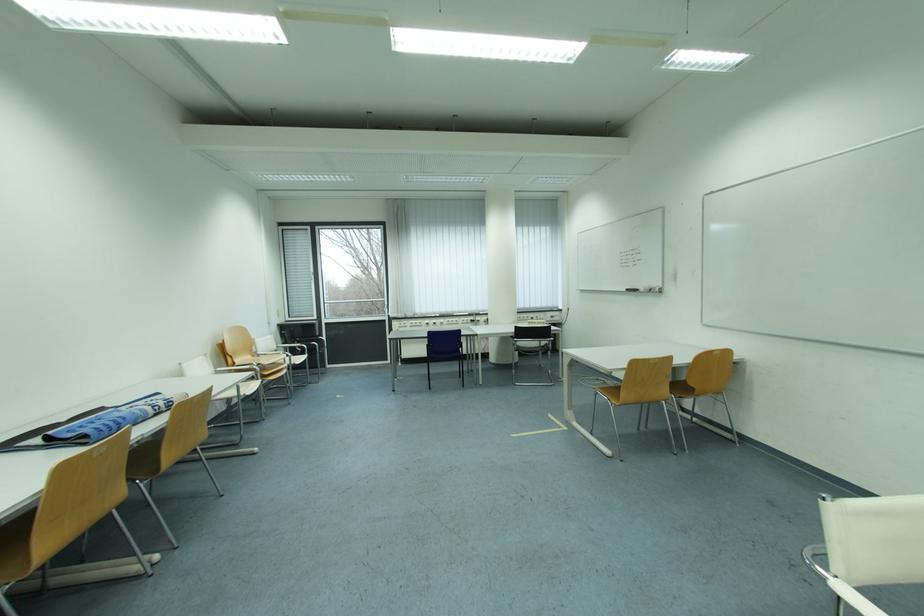
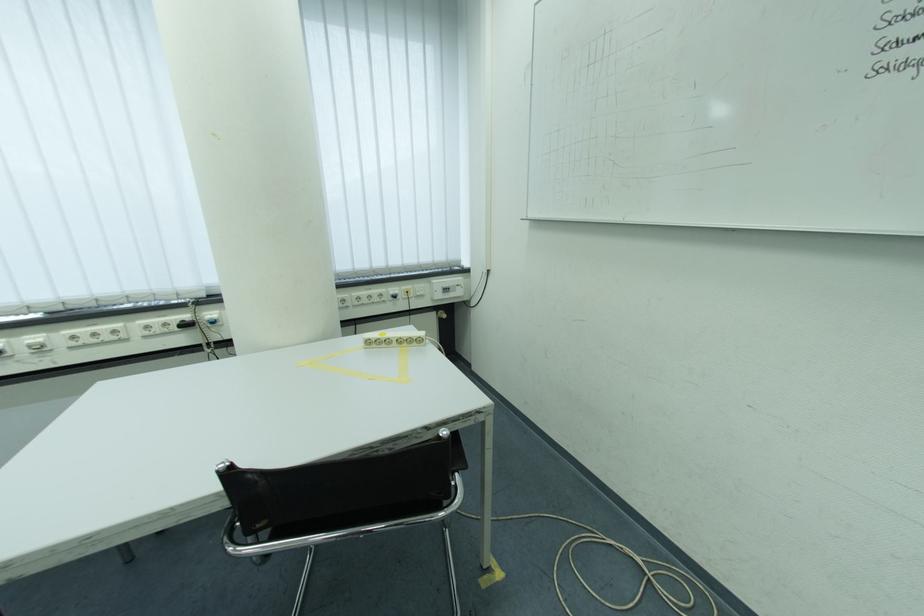
The point at (561,320) is marked in the first image. Where is the corresponding point in the second image?

(455, 292)